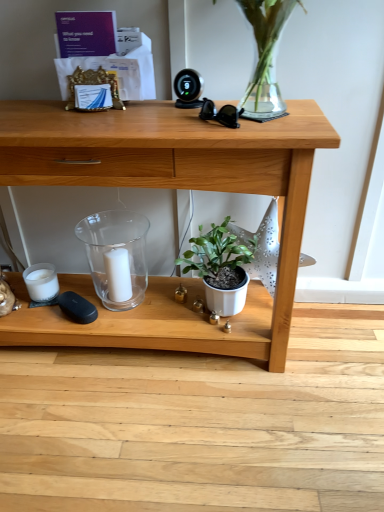
Identify the location of free space in front of wooden desk at center. (132, 432).